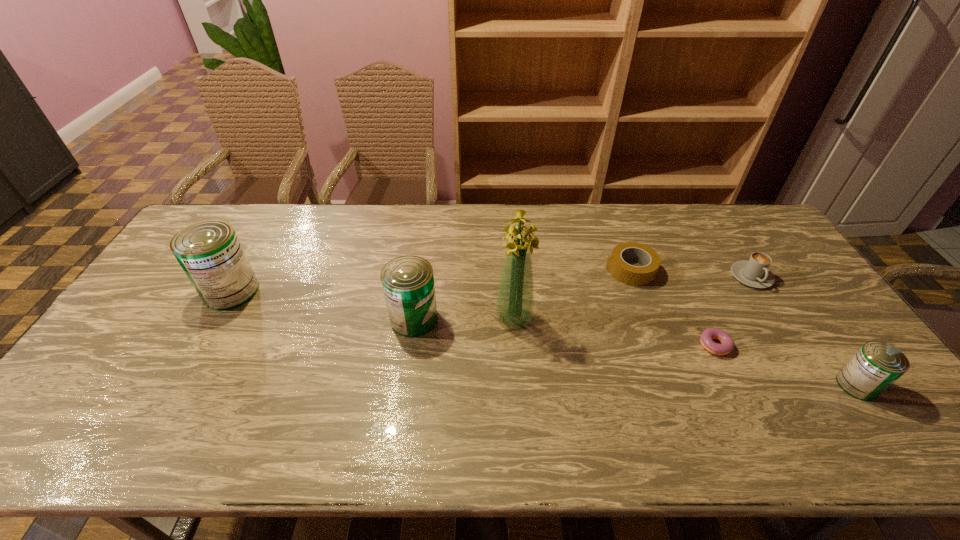
Where is `the third object from right to left`? The image size is (960, 540). the third object from right to left is located at coordinates (708, 334).

Image resolution: width=960 pixels, height=540 pixels. Identify the location of the shortest object. (708, 334).

Where is `free region located on the right of the leftmost object`? free region located on the right of the leftmost object is located at coordinates (317, 291).

I want to click on free space located 0.190m on the front of the second can from right to left, so click(x=402, y=400).

Identify the location of vacant space situated on the left of the fourth shortest object. This screenshot has height=540, width=960. (803, 385).

Where is `vacant region located to the right of the cappuccino`? This screenshot has height=540, width=960. vacant region located to the right of the cappuccino is located at coordinates (781, 324).

Where is `vacant space situated 0.050m on the front-facing side of the tallest object`? This screenshot has height=540, width=960. vacant space situated 0.050m on the front-facing side of the tallest object is located at coordinates (516, 346).

Where is `vacant space situated 0.120m at the edge of the duct tape`? This screenshot has width=960, height=540. vacant space situated 0.120m at the edge of the duct tape is located at coordinates (567, 270).

The height and width of the screenshot is (540, 960). I want to click on vacant space positioned 0.170m at the edge of the duct tape, so click(552, 270).

Locate an element on the screen. Image resolution: width=960 pixels, height=540 pixels. free space located at the edge of the duct tape is located at coordinates (508, 270).